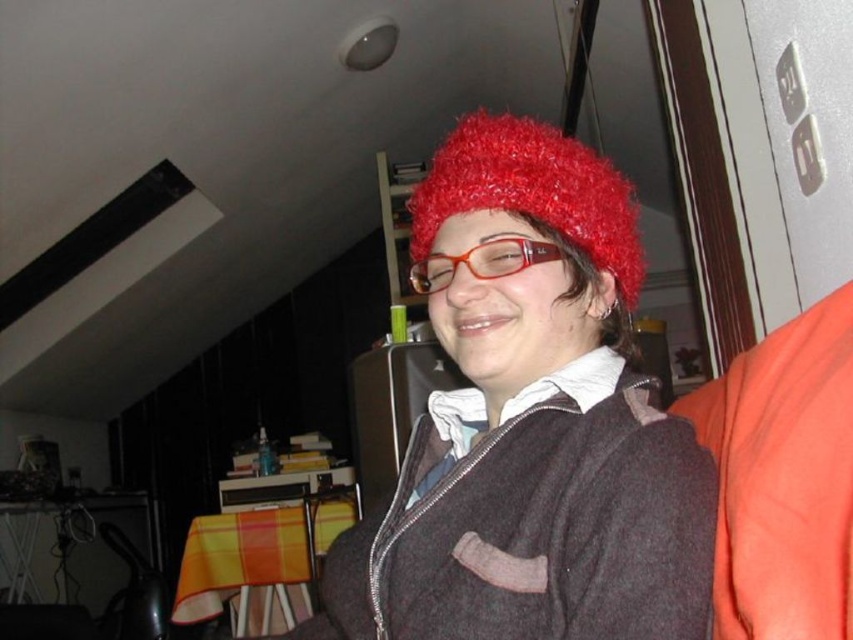
Does point (636, 250) come farther from viewer compared to point (550, 140)?

Yes.

The height and width of the screenshot is (640, 853). What do you see at coordinates (531, 422) in the screenshot? I see `fuzzy red hat at center` at bounding box center [531, 422].

Is point (572, 355) farther from camera compared to point (634, 216)?

No, (572, 355) is closer to viewer.

You are a GUI agent. You are given a task and a screenshot of the screen. Output one action in this format:
    pyautogui.click(x=<x>, y=<y>)
    Task: Click on the fuzzy red hat at center
    This screenshot has width=853, height=640.
    Given the screenshot: What is the action you would take?
    pyautogui.click(x=531, y=422)